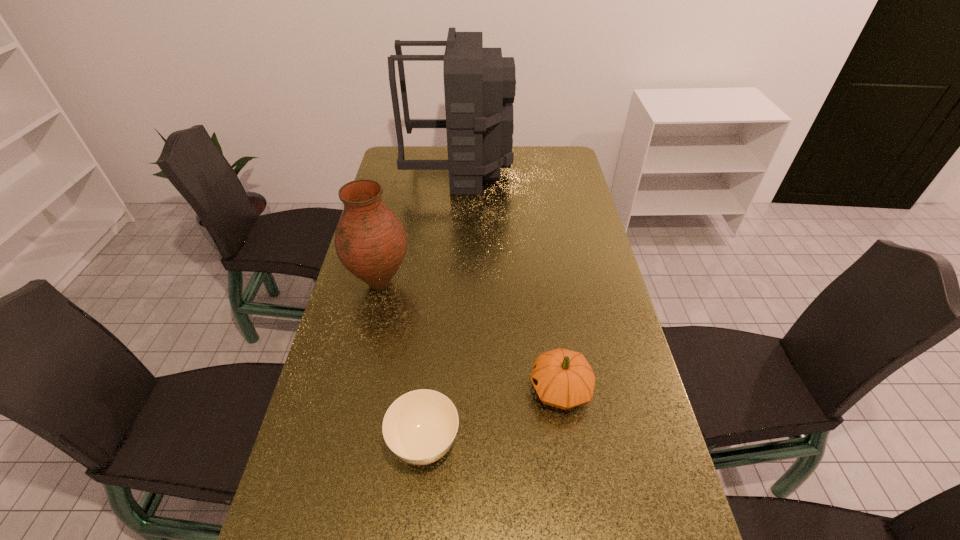
Where is `vacant position at the far left corner of the desktop`? vacant position at the far left corner of the desktop is located at coordinates (423, 150).

This screenshot has width=960, height=540. Identify the location of vacant area that lies between the vase and the second shortest object. (470, 336).

Identify the location of blank region between the farthest object and the second tallest object. (420, 226).

Locate an element on the screen. The image size is (960, 540). free space between the third nearest object and the sugar bowl is located at coordinates (402, 364).

You are a GUI agent. You are given a task and a screenshot of the screen. Output one action in this format:
    pyautogui.click(x=<x>, y=<y>)
    Task: Click on the free spot between the backpack and the vase
    This screenshot has width=960, height=540.
    Given the screenshot: What is the action you would take?
    pyautogui.click(x=420, y=226)

The width and height of the screenshot is (960, 540). In order to click on free spot between the vase and the backpack in this screenshot , I will do `click(420, 226)`.

The width and height of the screenshot is (960, 540). In order to click on vacant area that lies between the third nearest object and the sugar bowl in this screenshot , I will do `click(402, 364)`.

Locate an element on the screen. The image size is (960, 540). empty location between the backpack and the third nearest object is located at coordinates click(x=420, y=226).

Find the location of a particular element. The height and width of the screenshot is (540, 960). free space between the shortest object and the backpack is located at coordinates (442, 307).

Where is `vacant space in between the third tallest object and the third nearest object`? This screenshot has height=540, width=960. vacant space in between the third tallest object and the third nearest object is located at coordinates (470, 336).